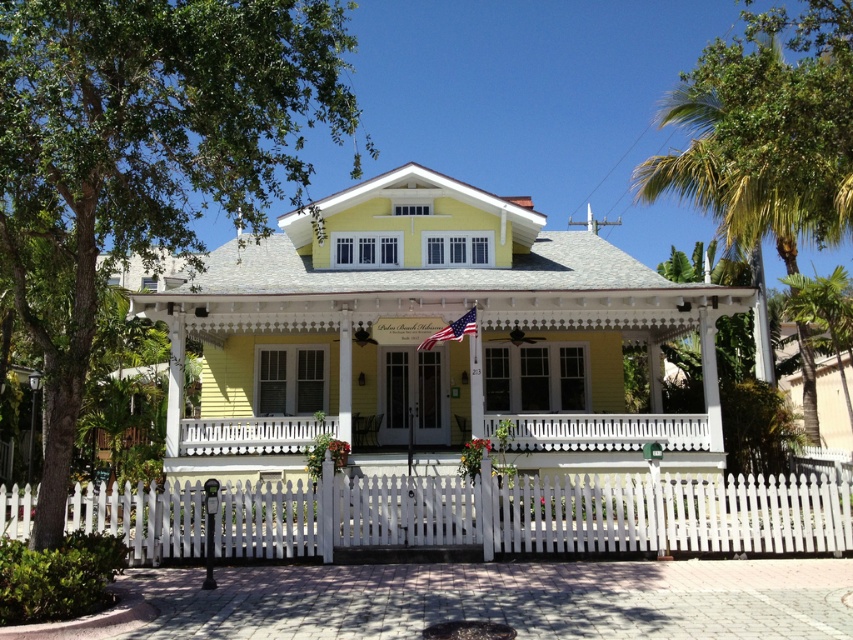
Which is above, green leafy palm tree at upper right or white wooden porch at center?

Positioned higher is green leafy palm tree at upper right.

Locate an element on the screen. green leafy palm tree at upper right is located at coordinates (766, 132).

Where is `green leafy palm tree at upper right`? green leafy palm tree at upper right is located at coordinates (766, 132).

Looking at this image, can you confirm if green leafy palm tree at upper right is taller than american flag at center?

Yes.

Between point (698, 61) and point (461, 321), which one is positioned behind?

The point (698, 61) is more distant.

Describe the element at coordinates (766, 132) in the screenshot. I see `green leafy palm tree at upper right` at that location.

Where is `green leafy palm tree at upper right`? The height and width of the screenshot is (640, 853). green leafy palm tree at upper right is located at coordinates (766, 132).

Between white wooden porch at center and green leafy palm tree at right, which one has less height?

With less height is white wooden porch at center.

Between point (288, 448) and point (795, 308), which one is positioned behind?

Positioned behind is point (795, 308).

Which is behind, point (619, 444) or point (793, 317)?

Positioned behind is point (793, 317).

Locate an element on the screen. This screenshot has height=640, width=853. white wooden porch at center is located at coordinates 602,429.